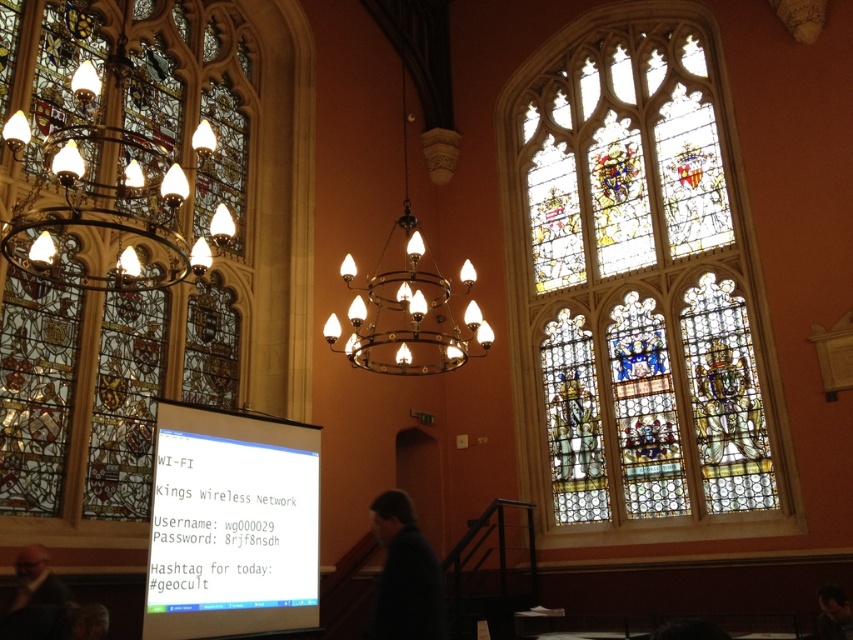
Does stained glass window at center appear under dark brown leather jacket at lower left?

No, stained glass window at center is not below dark brown leather jacket at lower left.

Is stained glass window at center taller than dark brown leather jacket at lower left?

Yes, stained glass window at center is taller than dark brown leather jacket at lower left.

Does point (541, 410) lie behind point (50, 604)?

Yes, point (541, 410) is farther from viewer.

Locate an element on the screen. This screenshot has height=640, width=853. stained glass window at center is located at coordinates (637, 289).

Can you confirm if white glossy projection screen at lower left is bigger than matte gold chandelier at upper left?

Incorrect, white glossy projection screen at lower left is not larger than matte gold chandelier at upper left.

Measure the distance between white glossy projection screen at lower left and matte gold chandelier at upper left.

white glossy projection screen at lower left is 12.55 meters away from matte gold chandelier at upper left.

Is point (233, 436) closer to camera compared to point (24, 131)?

No, (233, 436) is further to viewer.

You are a GUI agent. You are given a task and a screenshot of the screen. Output one action in this format:
    pyautogui.click(x=<x>, y=<y>)
    Task: Click on the white glossy projection screen at lower left
    
    Given the screenshot: What is the action you would take?
    pyautogui.click(x=231, y=524)

Is stained glass window at left to the left of dark brown leather jacket at lower right from the viewer's perspective?

Yes, stained glass window at left is to the left of dark brown leather jacket at lower right.

Is stained glass window at left taller than dark brown leather jacket at lower right?

Yes.

Who is more forward, (141, 378) or (827, 593)?

Positioned in front is point (827, 593).

Identify the location of stained glass window at left. The height and width of the screenshot is (640, 853). (119, 253).